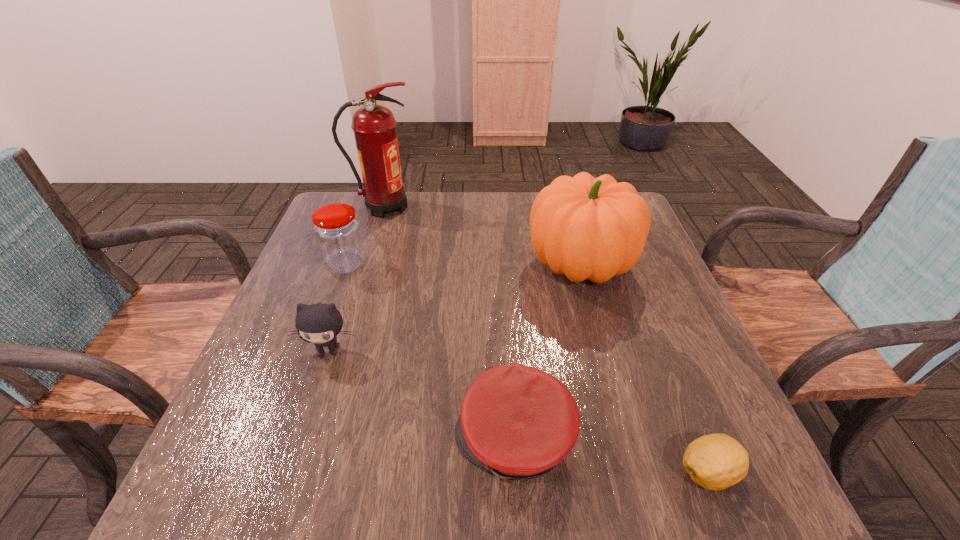
In order to click on vacant area situated 0.060m on the back of the third tallest object in this screenshot , I will do `click(355, 238)`.

Where is `vacant space positioned on the front-facing side of the third nearest object`? The image size is (960, 540). vacant space positioned on the front-facing side of the third nearest object is located at coordinates (295, 455).

Where is `blank space located 0.100m on the front of the second shortest object with an emblem`? blank space located 0.100m on the front of the second shortest object with an emblem is located at coordinates (396, 440).

Find the location of a particular element. Image resolution: width=960 pixels, height=540 pixels. free spot located on the front of the second shortest object with an emblem is located at coordinates [373, 440].

Image resolution: width=960 pixels, height=540 pixels. I want to click on vacant space located on the front of the second shortest object with an emblem, so click(x=345, y=440).

At what (x,y) coordinates should I click in order to perform the action: click on vacant region located at the stem end of the lemon. Please return your answer as a coordinate pair (x, y). The width and height of the screenshot is (960, 540). Looking at the image, I should click on click(529, 472).

Find the location of `free space located 0.240m at the stem end of the lemon`. free space located 0.240m at the stem end of the lemon is located at coordinates tap(529, 472).

Where is `vacant region located 0.210m at the stem end of the lemon`? The image size is (960, 540). vacant region located 0.210m at the stem end of the lemon is located at coordinates (547, 472).

Locate an element on the screen. fire extinguisher that is at the far edge is located at coordinates (374, 126).

The image size is (960, 540). I want to click on pumpkin that is at the far edge, so click(591, 228).